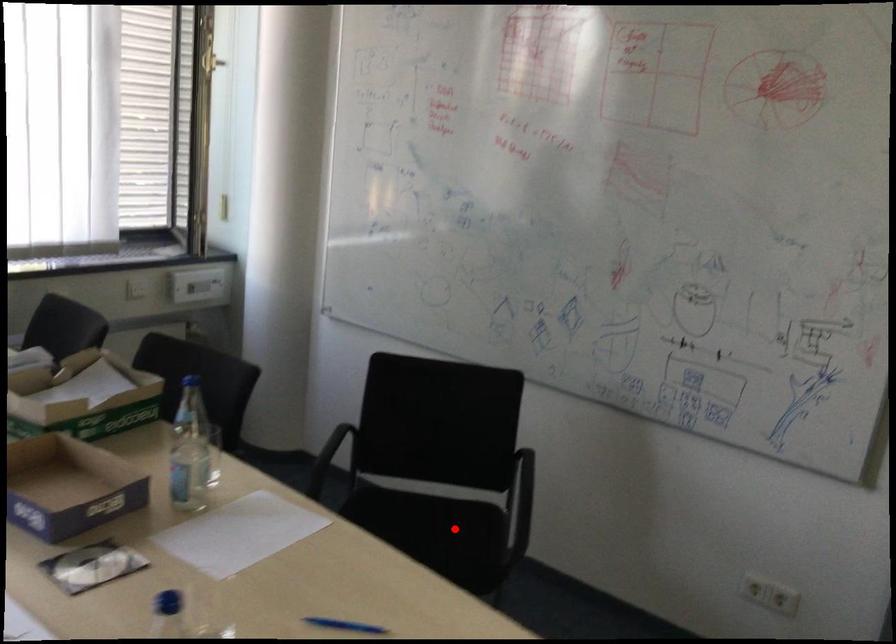
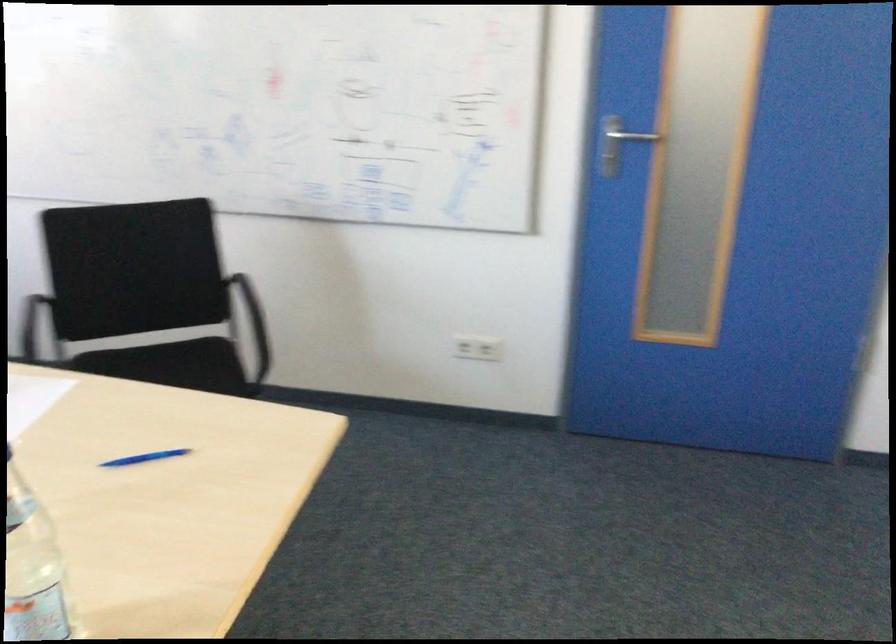
Find the pixel in the second image that matches the highlighted location in the first image.

(194, 364)